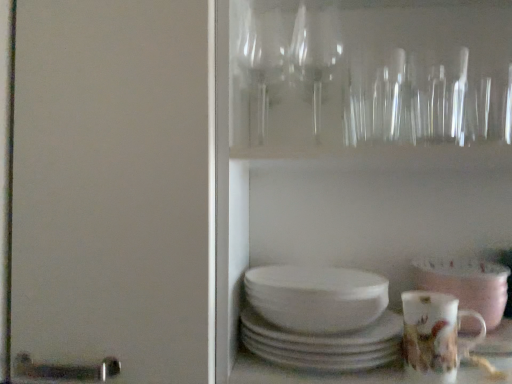
Where is `porcelain floral mug at lower right`? The image size is (512, 384). porcelain floral mug at lower right is located at coordinates (435, 336).

Measure the distance between porcelain floral mug at lower right and camera.

They are 58.10 centimeters apart.

Locate an element on the screen. This screenshot has height=384, width=512. white glossy bowl at lower right is located at coordinates (466, 284).

Considering the sizes of objects white glossy bowl at lower right and white glossy plates at center in the image provided, who is taller, white glossy bowl at lower right or white glossy plates at center?

white glossy plates at center is taller.

Is white glossy bowl at lower right far from white glossy plates at center?

That's not correct — white glossy bowl at lower right is a little close to white glossy plates at center.

From a real-world perspective, is white glossy bowl at lower right under white glossy plates at center?

Actually, white glossy bowl at lower right is physically above white glossy plates at center in the real world.

Looking at the image, does white glossy bowl at lower right seem bigger or smaller compared to white glossy plates at center?

white glossy bowl at lower right is smaller than white glossy plates at center.

There is a porcelain floral mug at lower right. Where is `bowl above it (from a real-world perspective)`? The height and width of the screenshot is (384, 512). bowl above it (from a real-world perspective) is located at coordinates (466, 284).

Would you say white glossy bowl at lower right is outside porcelain floral mug at lower right?

Yes.

Considering the positions of point (496, 296) and point (420, 335), is point (496, 296) closer or farther from the camera than point (420, 335)?

Point (496, 296) appears to be farther away from the viewer than point (420, 335).

Consider the image. Is white glossy bowl at lower right facing away from porcelain floral mug at lower right?

No, porcelain floral mug at lower right is not at the back of white glossy bowl at lower right.

From the image's perspective, is porcelain floral mug at lower right located beneath white glossy plates at center?

Yes.

Considering the relative positions of porcelain floral mug at lower right and white glossy plates at center in the image provided, is porcelain floral mug at lower right to the left of white glossy plates at center from the viewer's perspective?

No.

Is white glossy plates at center at the back of porcelain floral mug at lower right?

No.

Based on the photo, does porcelain floral mug at lower right have a lesser width compared to white glossy plates at center?

Yes, porcelain floral mug at lower right is thinner than white glossy plates at center.

From the image's perspective, is white glossy plates at center located above or below porcelain floral mug at lower right?

white glossy plates at center is above porcelain floral mug at lower right.

Consider the image. Is porcelain floral mug at lower right located within white glossy plates at center?

No, porcelain floral mug at lower right is not inside white glossy plates at center.

Does porcelain floral mug at lower right appear on the right side of white glossy bowl at lower right?

In fact, porcelain floral mug at lower right is to the left of white glossy bowl at lower right.

Considering the sizes of objects porcelain floral mug at lower right and white glossy bowl at lower right in the image provided, who is smaller, porcelain floral mug at lower right or white glossy bowl at lower right?

porcelain floral mug at lower right.

How much distance is there between porcelain floral mug at lower right and white glossy bowl at lower right?

They are 3.02 inches apart.

Are porcelain floral mug at lower right and white glossy bowl at lower right far apart?

No.

Considering the relative positions of white glossy plates at center and white glossy bowl at lower right in the image provided, is white glossy plates at center to the right of white glossy bowl at lower right from the viewer's perspective?

No.

Considering the sizes of objects white glossy plates at center and white glossy bowl at lower right in the image provided, who is thinner, white glossy plates at center or white glossy bowl at lower right?

Thinner between the two is white glossy bowl at lower right.

Between point (253, 349) and point (478, 311), which one is positioned behind?

The point (478, 311) is more distant.

Is white glossy plates at center aimed at white glossy bowl at lower right?

No, white glossy plates at center does not turn towards white glossy bowl at lower right.

This screenshot has width=512, height=384. In order to click on bowl on the right of white glossy plates at center in this screenshot , I will do `click(466, 284)`.

The image size is (512, 384). Identify the location of coffee cup located underneath the white glossy bowl at lower right (from a real-world perspective). (435, 336).

Based on their spatial positions, is porcelain floral mug at lower right or white glossy bowl at lower right further from white glossy plates at center?

white glossy bowl at lower right lies further to white glossy plates at center than the other object.

Considering their positions, is white glossy plates at center positioned further to white glossy bowl at lower right than porcelain floral mug at lower right?

white glossy plates at center lies further to white glossy bowl at lower right than the other object.

Which object lies nearer to the anchor point white glossy bowl at lower right, porcelain floral mug at lower right or white glossy plates at center?

Among the two, porcelain floral mug at lower right is located nearer to white glossy bowl at lower right.

Based on their spatial positions, is white glossy plates at center or white glossy bowl at lower right closer to porcelain floral mug at lower right?

Based on the image, white glossy bowl at lower right appears to be nearer to porcelain floral mug at lower right.

Based on their spatial positions, is white glossy bowl at lower right or white glossy plates at center further from porcelain floral mug at lower right?

Among the two, white glossy plates at center is located further to porcelain floral mug at lower right.

Looking at the image, which one is located further to white glossy plates at center, white glossy bowl at lower right or porcelain floral mug at lower right?

white glossy bowl at lower right is further to white glossy plates at center.

Where is `coffee cup situated between white glossy plates at center and white glossy bowl at lower right from left to right`? coffee cup situated between white glossy plates at center and white glossy bowl at lower right from left to right is located at coordinates click(x=435, y=336).